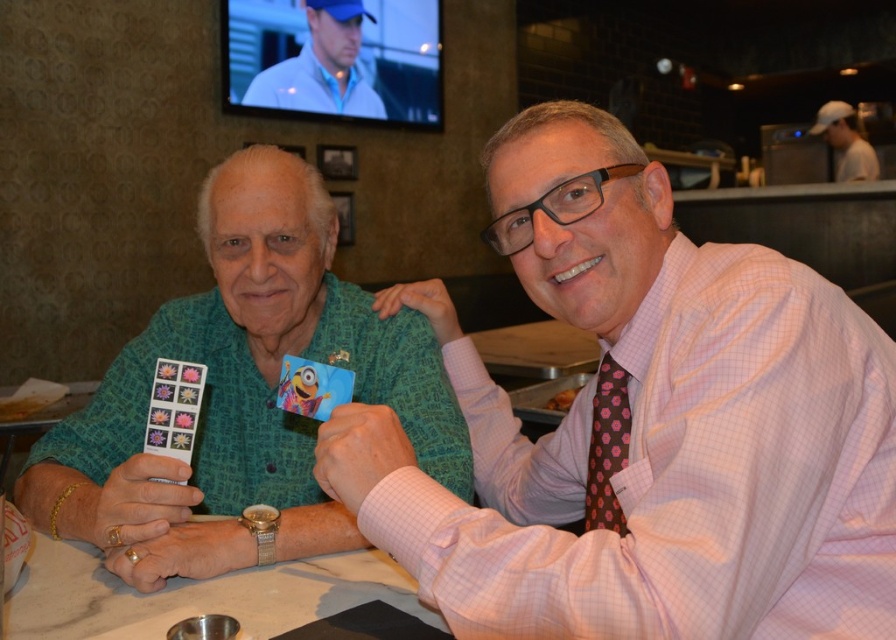
Question: Which point is closer to the camera taking this photo?

Choices:
 (A) (93, 561)
 (B) (269, 97)

Answer: (A)

Question: Which point is farther from the camera taking this photo?

Choices:
 (A) (602, 433)
 (B) (248, 321)
 (C) (541, 260)

Answer: (B)

Question: Can you confirm if blue fabric shirt at upper center is thinner than white cap at upper right?

Choices:
 (A) yes
 (B) no

Answer: (B)

Question: Which object is positioned farthest from the white cap at upper right?

Choices:
 (A) pink floral silk tie at right
 (B) pink checkered shirt at center
 (C) blue fabric shirt at upper center
 (D) white marble table at center

Answer: (D)

Question: Can you confirm if pink checkered shirt at center is positioned to the left of blue fabric shirt at upper center?

Choices:
 (A) yes
 (B) no

Answer: (B)

Question: Is white marble table at center to the right of blue fabric shirt at upper center from the viewer's perspective?

Choices:
 (A) yes
 (B) no

Answer: (A)